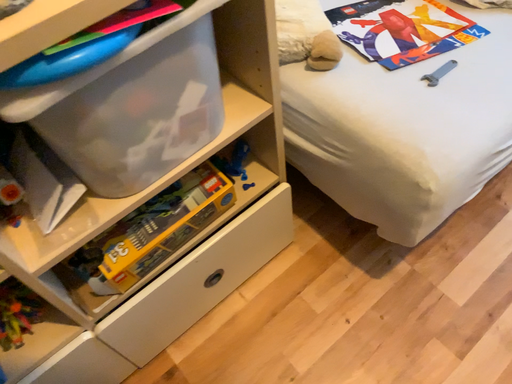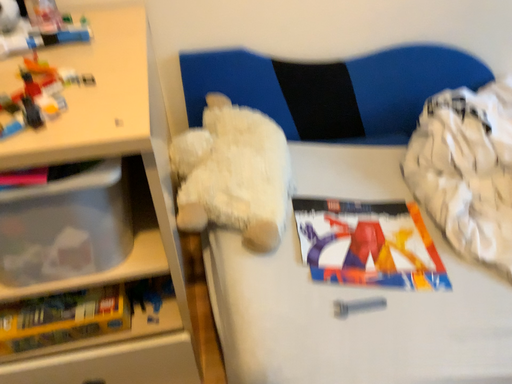
Question: Which way did the camera rotate in the video?

Choices:
 (A) rotated left
 (B) rotated right

Answer: (A)